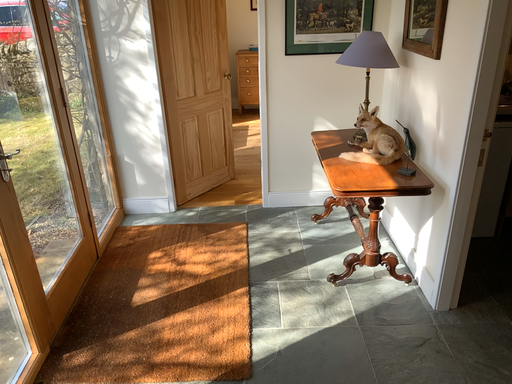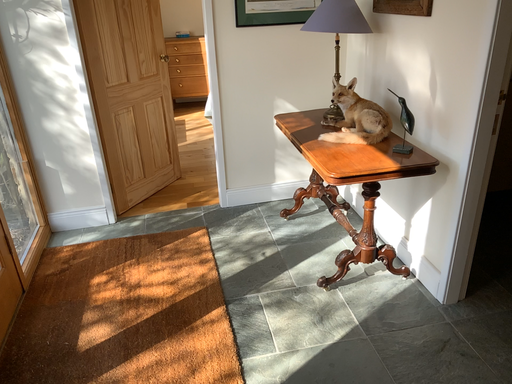
Question: How did the camera likely rotate when shooting the video?

Choices:
 (A) rotated left
 (B) rotated right

Answer: (B)